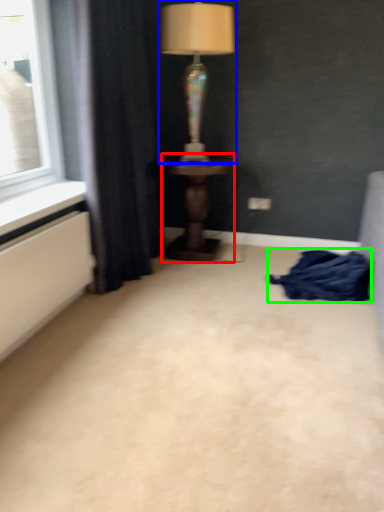
Question: Estimate the real-world distances between objects in this image. Which object is closer to table (highlighted by a red box), lamp (highlighted by a blue box) or blanket (highlighted by a green box)?

Choices:
 (A) lamp
 (B) blanket

Answer: (B)